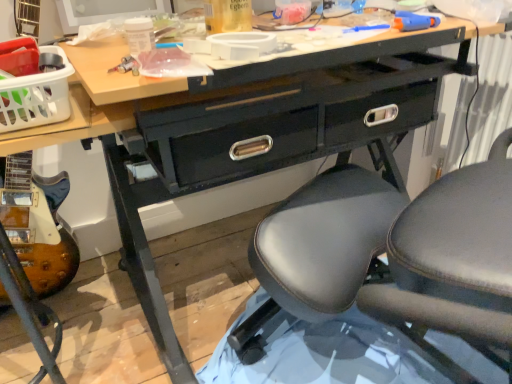
What are the coordinates of `free space to the back side of wooden electric guitar at lower left` in the screenshot? It's located at click(84, 298).